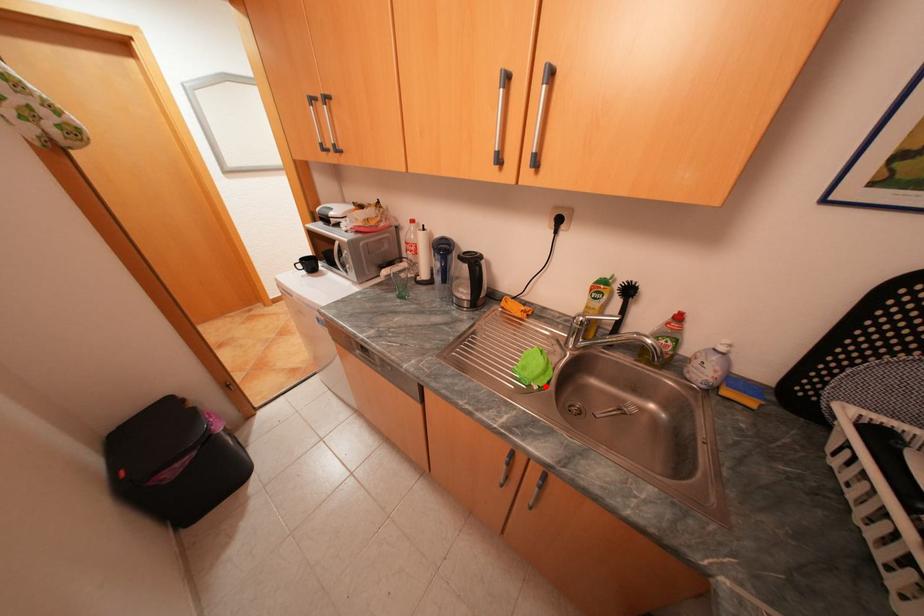
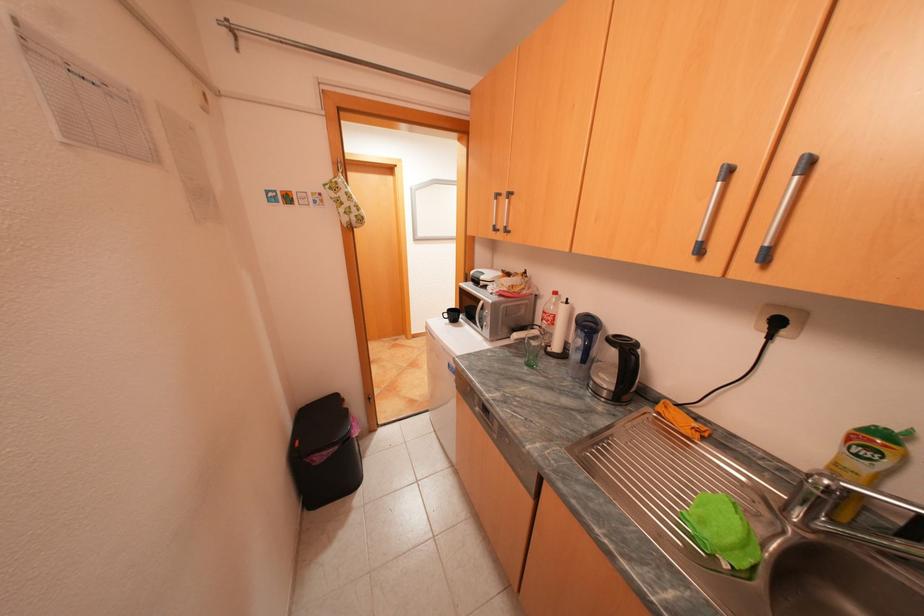
In the second image, find the point that corresponds to the highlighted location in the first image.

(736, 565)